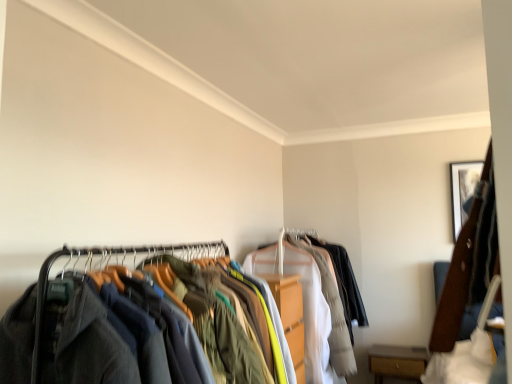
Question: Is wooden framed picture at upper right taller or shorter than dark gray fabric clothes at left?

Choices:
 (A) short
 (B) tall

Answer: (A)

Question: Considering the positions of point (461, 218) and point (120, 249), is point (461, 218) closer or farther from the camera than point (120, 249)?

Choices:
 (A) farther
 (B) closer

Answer: (B)

Question: Estimate the real-world distances between objects in this image. Which object is closer to the wooden framed picture at upper right?

Choices:
 (A) dark gray fabric clothes at left
 (B) light gray cotton shirt at center
 (C) brown wood drawer at lower right

Answer: (C)

Question: Considering the real-world distances, which object is closest to the dark gray fabric clothes at left?

Choices:
 (A) light gray cotton shirt at center
 (B) brown wood drawer at lower right
 (C) wooden framed picture at upper right

Answer: (A)